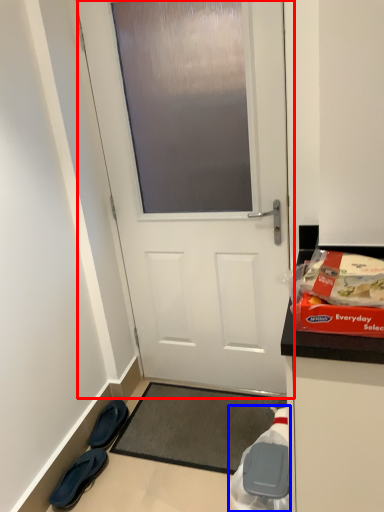
Question: Among these objects, which one is nearest to the camera, door (highlighted by a red box) or waste (highlighted by a blue box)?

Choices:
 (A) door
 (B) waste

Answer: (B)